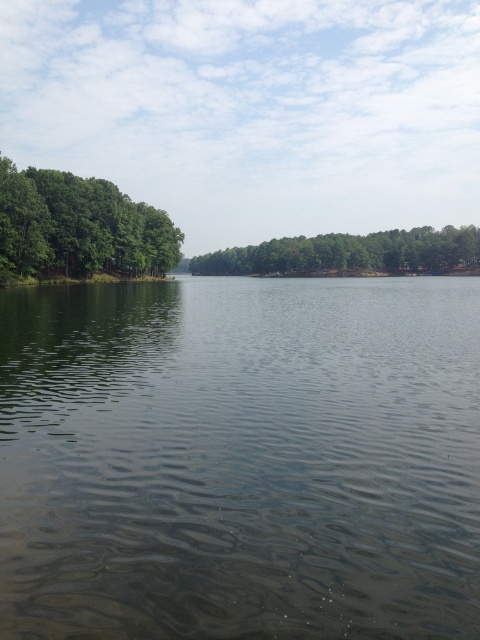
You are a kayaker planning to paddle across the lake. You see the clear water at center and the green matte trees at center. Which object is directly above the other?

The green matte trees at center are directly above the clear water at center.

You are an artist painting this lakeside scene. You need to decide which area to focus on first based on their sizes. Which object should you paint first, the clear water at center or the green matte trees at center?

The clear water at center has a smaller size compared to the green matte trees at center, so you should paint the green matte trees at center first as they occupy a larger area in the scene.

You are standing at the lakeside and notice the green leafy trees at left and the green matte trees at center. Which group of trees appears taller from your vantage point?

The green matte trees at center appear taller than the green leafy trees at left from your vantage point.